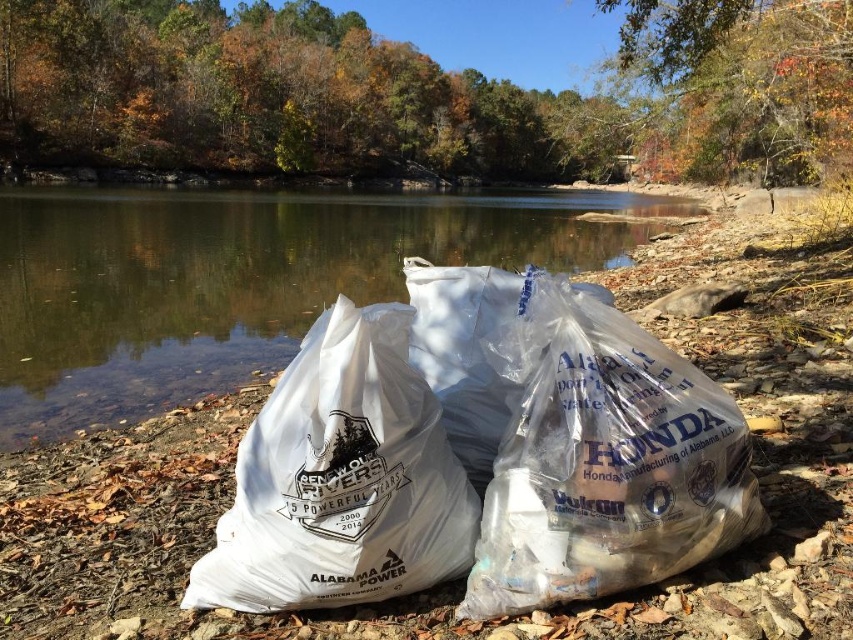
From the picture: You are a park ranger organizing items along the riverside. You have a transparent plastic bags at center and a white plastic bag at center in front of you. Which of these two items is located to the left?

The transparent plastic bags at center is positioned on the left side of white plastic bag at center, so the transparent plastic bags at center is located to the left.